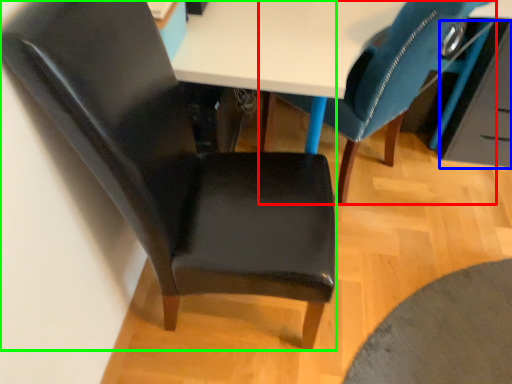
Question: Based on their relative distances, which object is farther from chair (highlighted by a red box)? Choose from drawer (highlighted by a blue box) and chair (highlighted by a green box).

Choices:
 (A) drawer
 (B) chair

Answer: (B)